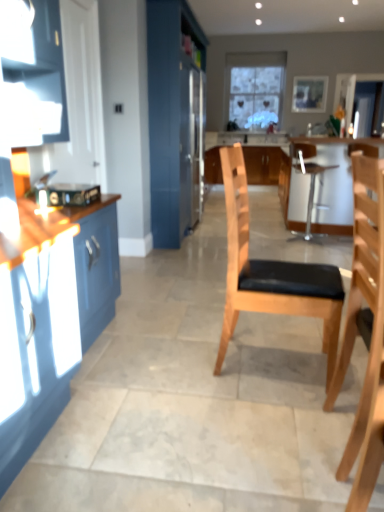
This screenshot has height=512, width=384. What do you see at coordinates (254, 88) in the screenshot?
I see `clear glass window at center` at bounding box center [254, 88].

The width and height of the screenshot is (384, 512). What do you see at coordinates (335, 183) in the screenshot?
I see `white glossy counter at center` at bounding box center [335, 183].

What do you see at coordinates (73, 194) in the screenshot? I see `metallic silver toaster at left` at bounding box center [73, 194].

Where is `satin silver refrigerator at center`? satin silver refrigerator at center is located at coordinates (191, 142).

Find the location of a particular element. The height and width of the screenshot is (512, 384). natural wood chair at center, the second chair in the right-to-left sequence is located at coordinates (365, 331).

Is point (62, 190) farther from camera compared to point (195, 67)?

No, (62, 190) is in front of (195, 67).

Can you confirm if metallic silver toaster at left is smaller than satin silver refrigerator at center?

Indeed, metallic silver toaster at left has a smaller size compared to satin silver refrigerator at center.

From the image's perspective, which object appears higher, metallic silver toaster at left or satin silver refrigerator at center?

satin silver refrigerator at center.

Which is correct: metallic silver toaster at left is inside satin silver refrigerator at center, or outside of it?

metallic silver toaster at left is not enclosed by satin silver refrigerator at center.

Can you confirm if clear glass window at center is thinner than light brown wooden chair at center?

Correct, the width of clear glass window at center is less than that of light brown wooden chair at center.

Based on the photo, could you tell me if clear glass window at center is facing light brown wooden chair at center?

Yes, clear glass window at center is oriented towards light brown wooden chair at center.

Does clear glass window at center have a greater height compared to light brown wooden chair at center?

Yes, clear glass window at center is taller than light brown wooden chair at center.

Between wooden cabinet at center, the 1th cabinetry when ordered from right to left, and clear glass window at center, which one has larger width?

wooden cabinet at center, the 1th cabinetry when ordered from right to left, is wider.

Would you say clear glass window at center is part of wooden cabinet at center, the second cabinetry in the left-to-right sequence,'s contents?

That's incorrect, clear glass window at center is not inside wooden cabinet at center, the second cabinetry in the left-to-right sequence.

Are wooden cabinet at center, the second cabinetry when ordered from front to back, and clear glass window at center making contact?

wooden cabinet at center, the second cabinetry when ordered from front to back, is not next to clear glass window at center, and they're not touching.

Does wooden cabinet at center, the second cabinetry in the left-to-right sequence, have a greater height compared to clear glass window at center?

Incorrect, the height of wooden cabinet at center, the second cabinetry in the left-to-right sequence, is not larger of that of clear glass window at center.

From a real-world perspective, is light wood/black cushioned chair at center, placed as the first chair when sorted from left to right, physically below metallic silver toaster at left?

Yes, from a real-world perspective, light wood/black cushioned chair at center, placed as the first chair when sorted from left to right, is under metallic silver toaster at left.

From the image's perspective, which is below, light wood/black cushioned chair at center, placed as the first chair when sorted from left to right, or metallic silver toaster at left?

light wood/black cushioned chair at center, placed as the first chair when sorted from left to right.

Which of these two, light wood/black cushioned chair at center, the second chair in the back-to-front sequence, or metallic silver toaster at left, stands shorter?

Standing shorter between the two is metallic silver toaster at left.

Considering the sizes of objects light wood/black cushioned chair at center, placed as the first chair when sorted from left to right, and metallic silver toaster at left in the image provided, who is thinner, light wood/black cushioned chair at center, placed as the first chair when sorted from left to right, or metallic silver toaster at left?

With smaller width is metallic silver toaster at left.

Can you confirm if white glossy counter at center is wider than satin silver refrigerator at center?

Yes, white glossy counter at center is wider than satin silver refrigerator at center.

From the image's perspective, between white glossy counter at center and satin silver refrigerator at center, who is located below?

white glossy counter at center.

From a real-world perspective, is white glossy counter at center under satin silver refrigerator at center?

Yes.

Consider the image. Is metallic silver stool at center, acting as the first chair starting from the right, aimed at satin silver refrigerator at center?

No, metallic silver stool at center, acting as the first chair starting from the right, is not turned towards satin silver refrigerator at center.

Considering the relative sizes of metallic silver stool at center, which appears as the third chair when viewed from the left, and satin silver refrigerator at center in the image provided, is metallic silver stool at center, which appears as the third chair when viewed from the left, taller than satin silver refrigerator at center?

Incorrect, the height of metallic silver stool at center, which appears as the third chair when viewed from the left, is not larger of that of satin silver refrigerator at center.

Looking at this image, from the image's perspective, is metallic silver stool at center, the 1th chair positioned from the back, on satin silver refrigerator at center?

No.

Between metallic silver stool at center, the 1th chair positioned from the back, and satin silver refrigerator at center, which one appears on the right side from the viewer's perspective?

From the viewer's perspective, metallic silver stool at center, the 1th chair positioned from the back, appears more on the right side.

Considering the relative positions of clear glass window at center and metallic silver toaster at left in the image provided, is clear glass window at center to the right of metallic silver toaster at left from the viewer's perspective?

Yes, clear glass window at center is to the right of metallic silver toaster at left.

Which is nearer, (278, 70) or (93, 199)?

Clearly, point (278, 70) is more distant from the camera than point (93, 199).

Is clear glass window at center in front of or behind metallic silver toaster at left in the image?

Clearly, clear glass window at center is behind metallic silver toaster at left.

The height and width of the screenshot is (512, 384). What are the coordinates of `appliance in front of the satin silver refrigerator at center` in the screenshot? It's located at (73, 194).

The width and height of the screenshot is (384, 512). What are the coordinates of `window located on the left of light brown wooden chair at center` in the screenshot? It's located at (254, 88).

Which object lies further to the anchor point light brown wooden chair at center, satin silver refrigerator at center or natural wood chair at center, marked as the first chair in a front-to-back arrangement?

satin silver refrigerator at center is further to light brown wooden chair at center.

Looking at the image, which one is located closer to white glossy counter at center, metallic silver stool at center, acting as the first chair starting from the right, or natural wood chair at center, marked as the first chair in a front-to-back arrangement?

metallic silver stool at center, acting as the first chair starting from the right, is closer to white glossy counter at center.

When comparing their distances from satin silver refrigerator at center, which ranks as the 2th cabinetry in right-to-left order, does satin silver refrigerator at center or white glossy counter at center seem closer?

satin silver refrigerator at center is positioned closer to the anchor satin silver refrigerator at center, which ranks as the 2th cabinetry in right-to-left order.

Based on their spatial positions, is metallic silver stool at center, positioned as the third chair in front-to-back order, or wooden picture frame at upper center further from satin silver refrigerator at center, which appears as the first cabinetry when viewed from the left?

wooden picture frame at upper center.

Based on their spatial positions, is white glossy counter at center or metallic silver toaster at left closer to clear glass window at center?

The object closer to clear glass window at center is white glossy counter at center.

Which object lies nearer to the anchor point wooden cabinet at center, acting as the first cabinetry starting from the back, metallic silver stool at center, which appears as the third chair when viewed from the left, or clear glass window at center?

clear glass window at center is closer to wooden cabinet at center, acting as the first cabinetry starting from the back.

Considering their positions, is natural wood chair at center, the second chair in the right-to-left sequence, positioned closer to metallic silver stool at center, the 1th chair positioned from the back, than satin silver refrigerator at center?

Among the two, satin silver refrigerator at center is located nearer to metallic silver stool at center, the 1th chair positioned from the back.

From the image, which object appears to be nearer to metallic silver stool at center, which appears as the third chair when viewed from the left, natural wood chair at center, placed as the second chair when sorted from left to right, or wooden cabinet at center, the second cabinetry when ordered from front to back?

wooden cabinet at center, the second cabinetry when ordered from front to back.

Locate an element on the screen. picture frame located between metallic silver toaster at left and clear glass window at center in the depth direction is located at coordinates (309, 93).

I want to click on cabinetry between metallic silver stool at center, positioned as the third chair in front-to-back order, and clear glass window at center from front to back, so click(265, 164).

The height and width of the screenshot is (512, 384). In order to click on appliance between light wood/black cushioned chair at center, placed as the first chair when sorted from left to right, and clear glass window at center in the front-back direction in this screenshot , I will do `click(73, 194)`.

Find the location of a particular element. refrigerator between metallic silver toaster at left and wooden cabinet at center, the second cabinetry in the left-to-right sequence, in the front-back direction is located at coordinates (191, 142).